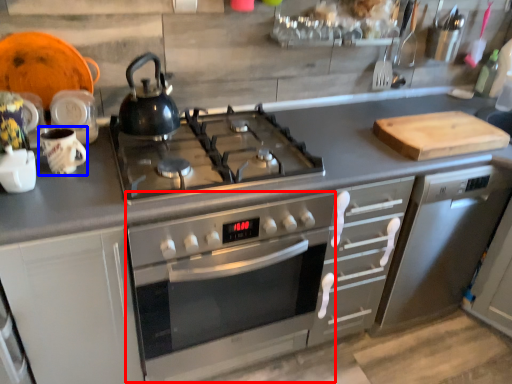
Question: Among these objects, which one is farthest to the camera, oven (highlighted by a red box) or mug (highlighted by a blue box)?

Choices:
 (A) oven
 (B) mug

Answer: (B)